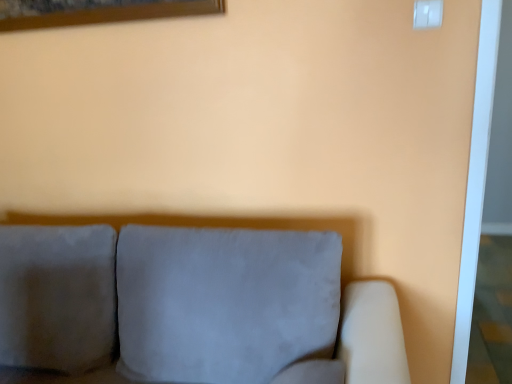
Question: Is white plastic switch at upper right positioned far away from suede gray couch at center?

Choices:
 (A) no
 (B) yes

Answer: (B)

Question: Can you confirm if white plastic switch at upper right is bigger than suede gray couch at center?

Choices:
 (A) yes
 (B) no

Answer: (B)

Question: Would you say suede gray couch at center is part of white plastic switch at upper right's contents?

Choices:
 (A) yes
 (B) no

Answer: (B)

Question: Is white plastic switch at upper right wider than suede gray couch at center?

Choices:
 (A) yes
 (B) no

Answer: (B)

Question: Is white plastic switch at upper right positioned in front of suede gray couch at center?

Choices:
 (A) yes
 (B) no

Answer: (B)

Question: Is white plastic switch at upper right at the left side of suede gray couch at center?

Choices:
 (A) no
 (B) yes

Answer: (A)

Question: Is suede gray couch at center beside white plastic switch at upper right?

Choices:
 (A) no
 (B) yes

Answer: (A)

Question: Does suede gray couch at center appear on the right side of white plastic switch at upper right?

Choices:
 (A) no
 (B) yes

Answer: (A)

Question: Is suede gray couch at center not within white plastic switch at upper right?

Choices:
 (A) no
 (B) yes

Answer: (B)

Question: Considering the relative sizes of suede gray couch at center and white plastic switch at upper right in the image provided, is suede gray couch at center shorter than white plastic switch at upper right?

Choices:
 (A) yes
 (B) no

Answer: (B)

Question: Does suede gray couch at center have a larger size compared to white plastic switch at upper right?

Choices:
 (A) no
 (B) yes

Answer: (B)

Question: From the image's perspective, is suede gray couch at center located beneath white plastic switch at upper right?

Choices:
 (A) no
 (B) yes

Answer: (B)

Question: Considering the relative positions of suede gray couch at center and white plastic switch at upper right in the image provided, is suede gray couch at center to the left or to the right of white plastic switch at upper right?

Choices:
 (A) left
 (B) right

Answer: (A)